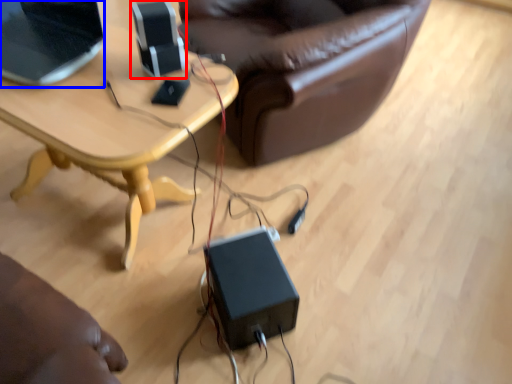
Question: Which object is closer to the camera taking this photo, speaker (highlighted by a red box) or laptop (highlighted by a blue box)?

Choices:
 (A) speaker
 (B) laptop

Answer: (B)